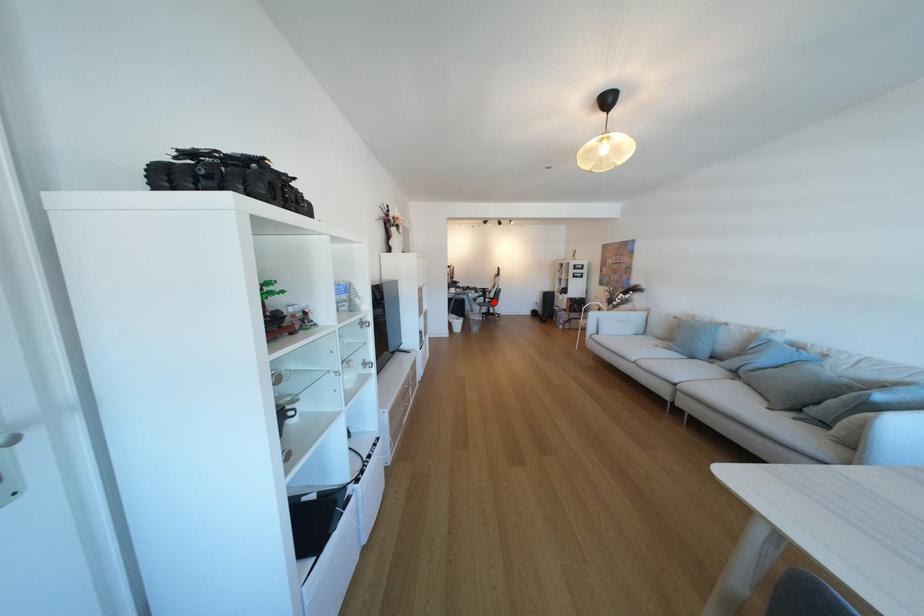
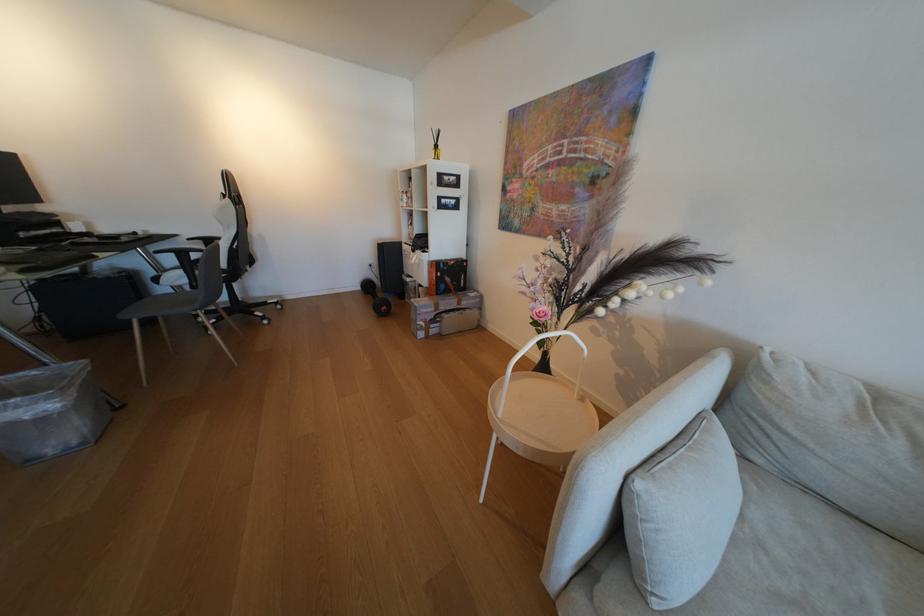
In the second image, find the point that corresponds to the highlighted location in the first image.

(196, 282)